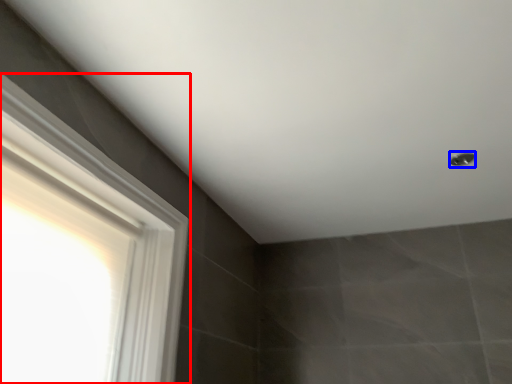
Question: Among these objects, which one is farthest to the camera, window (highlighted by a red box) or shower (highlighted by a blue box)?

Choices:
 (A) window
 (B) shower

Answer: (B)